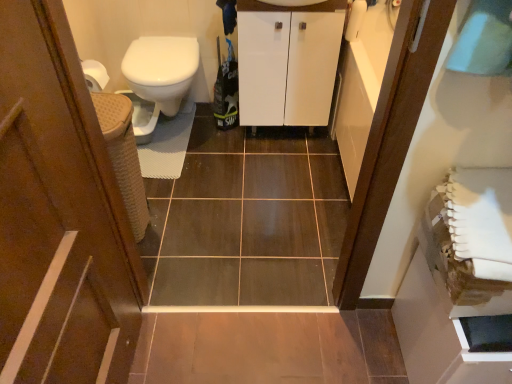
Question: From the image's perspective, is brown wood door at left on top of white glossy bidet at left?

Choices:
 (A) no
 (B) yes

Answer: (A)

Question: Does brown wood door at left have a smaller size compared to white glossy bidet at left?

Choices:
 (A) no
 (B) yes

Answer: (A)

Question: Can you confirm if brown wood door at left is thinner than white glossy bidet at left?

Choices:
 (A) yes
 (B) no

Answer: (A)

Question: Is brown wood door at left placed right next to white glossy bidet at left?

Choices:
 (A) no
 (B) yes

Answer: (A)

Question: Could white glossy bidet at left be considered to be inside brown wood door at left?

Choices:
 (A) no
 (B) yes

Answer: (A)

Question: Is brown wood door at left aimed at white glossy bidet at left?

Choices:
 (A) yes
 (B) no

Answer: (B)

Question: Can you confirm if white glossy bidet at left is thinner than brown wood door at left?

Choices:
 (A) no
 (B) yes

Answer: (A)

Question: Is white glossy bidet at left positioned behind brown wood door at left?

Choices:
 (A) no
 (B) yes

Answer: (B)

Question: Does white glossy bidet at left contain brown wood door at left?

Choices:
 (A) no
 (B) yes

Answer: (A)

Question: Can you see white glossy bidet at left touching brown wood door at left?

Choices:
 (A) yes
 (B) no

Answer: (B)

Question: Is white glossy bidet at left to the right of brown wood door at left from the viewer's perspective?

Choices:
 (A) yes
 (B) no

Answer: (B)

Question: Could you tell me if white glossy bidet at left is facing brown wood door at left?

Choices:
 (A) no
 (B) yes

Answer: (B)

Question: Is white glossy cabinet at center positioned with its back to white glossy bidet at left?

Choices:
 (A) yes
 (B) no

Answer: (B)